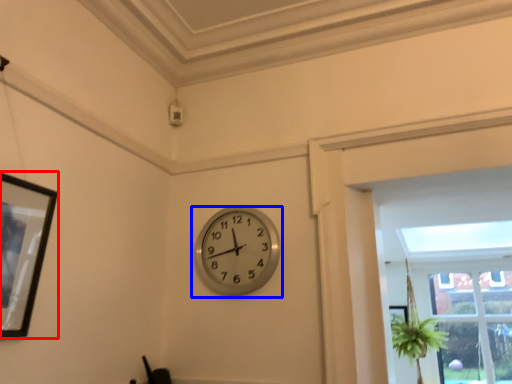
Question: Among these objects, which one is nearest to the camera, picture frame (highlighted by a red box) or wall clock (highlighted by a blue box)?

Choices:
 (A) picture frame
 (B) wall clock

Answer: (A)